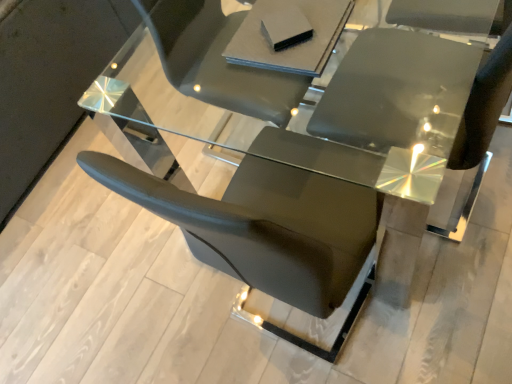
Question: Can you confirm if glossy black chair at center is smaller than matte gray book at upper center, which is the second table from front to back?

Choices:
 (A) yes
 (B) no

Answer: (B)

Question: From the image's perspective, is glossy black chair at center beneath matte gray book at upper center, the 1th table in the bottom-to-top sequence?

Choices:
 (A) no
 (B) yes

Answer: (B)

Question: Is glossy black chair at center positioned beyond the bounds of matte gray book at upper center, placed as the 1th table when sorted from back to front?

Choices:
 (A) yes
 (B) no

Answer: (A)

Question: Can you confirm if glossy black chair at center is taller than matte gray book at upper center, which is the second table from front to back?

Choices:
 (A) no
 (B) yes

Answer: (B)

Question: Can matte gray book at upper center, the 1th table in the bottom-to-top sequence, be found inside glossy black chair at center?

Choices:
 (A) no
 (B) yes

Answer: (B)

Question: Are glossy black chair at center and matte gray book at upper center, the 1th table in the bottom-to-top sequence, located far from each other?

Choices:
 (A) yes
 (B) no

Answer: (B)

Question: Could you tell me if transparent glass table at center, which is the 2th table in back-to-front order, is turned towards matte gray book at upper center, placed as the 1th table when sorted from back to front?

Choices:
 (A) yes
 (B) no

Answer: (B)

Question: From a real-world perspective, is transparent glass table at center, which is the 2th table in back-to-front order, positioned over matte gray book at upper center, positioned as the 2th table in top-to-bottom order, based on gravity?

Choices:
 (A) no
 (B) yes

Answer: (A)

Question: Can you confirm if transparent glass table at center, which is the 2th table in back-to-front order, is smaller than matte gray book at upper center, which is the second table from front to back?

Choices:
 (A) no
 (B) yes

Answer: (A)

Question: Are transparent glass table at center, arranged as the 1th table when viewed from the top, and matte gray book at upper center, which is the second table from front to back, beside each other?

Choices:
 (A) yes
 (B) no

Answer: (B)

Question: From the image's perspective, does transparent glass table at center, arranged as the 1th table when viewed from the top, appear lower than matte gray book at upper center, the 1th table in the bottom-to-top sequence?

Choices:
 (A) no
 (B) yes

Answer: (A)

Question: From a real-world perspective, is transparent glass table at center, arranged as the first table when viewed from the front, located beneath glossy black chair at center?

Choices:
 (A) yes
 (B) no

Answer: (A)